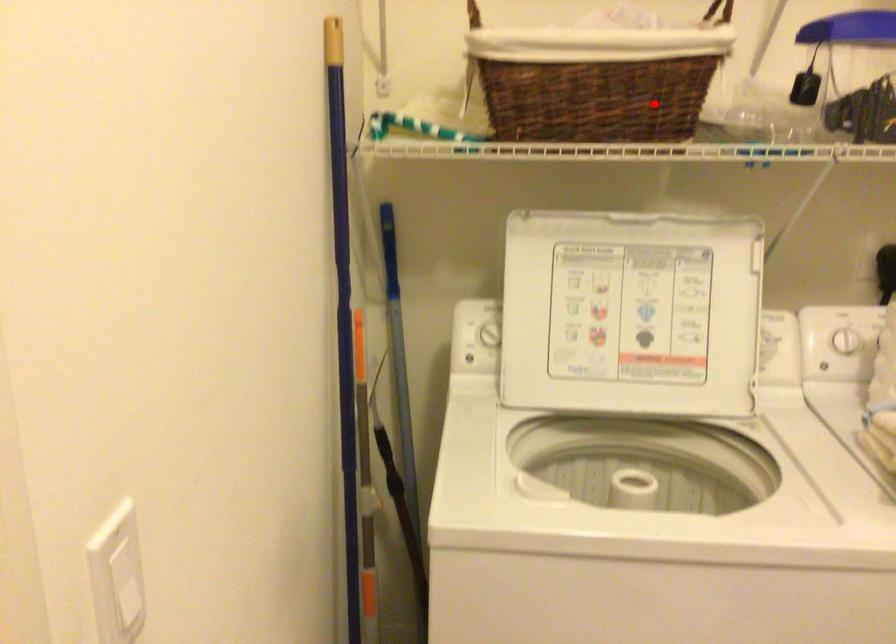
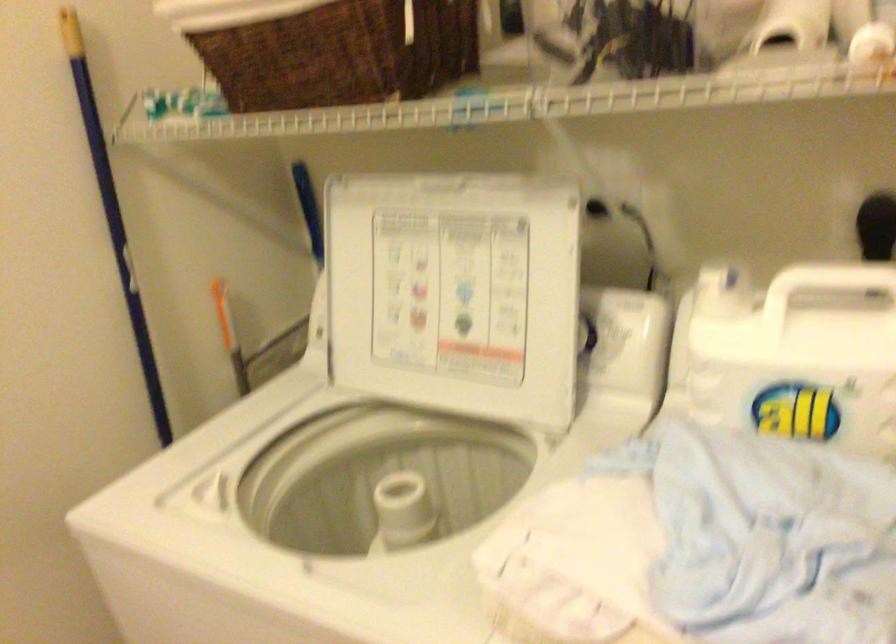
Locate, in the second image, the point that corresponds to the highlighted location in the first image.

(340, 53)